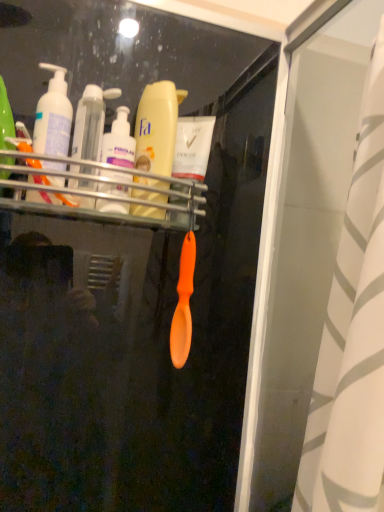
How much space does translucent plastic bottles at center, arranged as the second toiletry when viewed from the left, occupy horizontally?

It is 3.88 inches.

In order to face matte white pump bottle at left, should I rotate leftwards or rightwards?

Turn left approximately 18.345 degrees to face it.

Locate an element on the screen. translucent plastic bottles at center, arranged as the second toiletry when viewed from the left is located at coordinates (119, 142).

Does yellow matte lotion at center lie behind matte white pump bottle at left?

Yes, yellow matte lotion at center is further from the camera.

Is yellow matte lotion at center aimed at matte white pump bottle at left?

No, yellow matte lotion at center is not oriented towards matte white pump bottle at left.

Between yellow matte lotion at center and matte white pump bottle at left, which one has larger size?

matte white pump bottle at left is bigger.

From the image's perspective, which is below, matte white pump bottle at left or yellow matte lotion at center?

yellow matte lotion at center.

Is matte white pump bottle at left smaller than yellow matte lotion at center?

No.

Could you tell me if matte white pump bottle at left is facing yellow matte lotion at center?

No, matte white pump bottle at left is not turned towards yellow matte lotion at center.

Which of these two, matte white pump bottle at left or yellow matte lotion at center, is thinner?

yellow matte lotion at center is thinner.

Is translucent plastic bottles at center, marked as the first toiletry in a right-to-left arrangement, facing towards matte white pump bottle at left?

No, translucent plastic bottles at center, marked as the first toiletry in a right-to-left arrangement, is not facing towards matte white pump bottle at left.

From the image's perspective, does translucent plastic bottles at center, marked as the first toiletry in a right-to-left arrangement, appear lower than matte white pump bottle at left?

Yes.

Considering the relative positions of translucent plastic bottles at center, marked as the first toiletry in a right-to-left arrangement, and matte white pump bottle at left in the image provided, is translucent plastic bottles at center, marked as the first toiletry in a right-to-left arrangement, behind matte white pump bottle at left?

Yes, translucent plastic bottles at center, marked as the first toiletry in a right-to-left arrangement, is further from the viewer.

Considering the points (357, 311) and (71, 104), which point is behind, point (357, 311) or point (71, 104)?

The point (71, 104) is behind.

Based on the photo, is the position of white striped fabric at right less distant than that of matte white pump bottle at left?

Yes, white striped fabric at right is in front of matte white pump bottle at left.

How many degrees apart are the facing directions of yellow matte lotion at center and translucent plastic bottles at center left, the second toiletry when ordered from right to left?

The angle between the facing direction of yellow matte lotion at center and the facing direction of translucent plastic bottles at center left, the second toiletry when ordered from right to left, is 0.00444 degrees.

Considering the positions of objects yellow matte lotion at center and translucent plastic bottles at center left, which ranks as the 1th toiletry in left-to-right order, in the image provided, who is more to the right, yellow matte lotion at center or translucent plastic bottles at center left, which ranks as the 1th toiletry in left-to-right order,?

yellow matte lotion at center is more to the right.

Which object is further away from the camera, yellow matte lotion at center or translucent plastic bottles at center left, the second toiletry when ordered from right to left?

yellow matte lotion at center is further away from the camera.

The height and width of the screenshot is (512, 384). I want to click on bottle above the translucent plastic bottles at center left, the second toiletry when ordered from right to left (from the image's perspective), so click(157, 127).

Is translucent plastic bottles at center left, the second toiletry when ordered from right to left, surrounded by matte white pump bottle at left?

No.

From the picture: From the image's perspective, is matte white pump bottle at left positioned above or below translucent plastic bottles at center left, which ranks as the 1th toiletry in left-to-right order?

From the image's perspective, matte white pump bottle at left appears above translucent plastic bottles at center left, which ranks as the 1th toiletry in left-to-right order.

Looking at this image, looking at the image, does matte white pump bottle at left seem bigger or smaller compared to translucent plastic bottles at center left, the second toiletry when ordered from right to left?

Considering their sizes, matte white pump bottle at left takes up more space than translucent plastic bottles at center left, the second toiletry when ordered from right to left.

From the image's perspective, is white striped fabric at right beneath translucent plastic bottles at center left, which ranks as the 1th toiletry in left-to-right order?

Yes.

Does white striped fabric at right appear on the left side of translucent plastic bottles at center left, the second toiletry when ordered from right to left?

Incorrect, white striped fabric at right is not on the left side of translucent plastic bottles at center left, the second toiletry when ordered from right to left.

Measure the distance between white striped fabric at right and translucent plastic bottles at center left, the second toiletry when ordered from right to left.

white striped fabric at right and translucent plastic bottles at center left, the second toiletry when ordered from right to left, are 15.28 inches apart.

From a real-world perspective, is white striped fabric at right on top of translucent plastic bottles at center left, which ranks as the 1th toiletry in left-to-right order?

Incorrect, from a real-world perspective, white striped fabric at right is lower than translucent plastic bottles at center left, which ranks as the 1th toiletry in left-to-right order.

Find the location of a particular element. The height and width of the screenshot is (512, 384). cleaning product that is on the left side of yellow matte lotion at center is located at coordinates (53, 116).

At what (x,y) coordinates should I click in order to perform the action: click on bottle that appears on the right of matte white pump bottle at left. Please return your answer as a coordinate pair (x, y). Looking at the image, I should click on (157, 127).

Which object lies nearer to the anchor point white striped fabric at right, yellow matte lotion at center or translucent plastic bottles at center, arranged as the second toiletry when viewed from the left?

Among the two, yellow matte lotion at center is located nearer to white striped fabric at right.

Estimate the real-world distances between objects in this image. Which object is further from yellow matte lotion at center, white striped fabric at right or translucent plastic bottles at center left, which ranks as the 1th toiletry in left-to-right order?

white striped fabric at right is positioned further to the anchor yellow matte lotion at center.

From the image, which object appears to be nearer to yellow matte lotion at center, matte white pump bottle at left or white striped fabric at right?

The object closer to yellow matte lotion at center is matte white pump bottle at left.

Considering their positions, is yellow matte lotion at center positioned further to white striped fabric at right than matte white pump bottle at left?

Based on the image, matte white pump bottle at left appears to be further to white striped fabric at right.

Which object lies nearer to the anchor point translucent plastic bottles at center left, which ranks as the 1th toiletry in left-to-right order, translucent plastic bottles at center, arranged as the second toiletry when viewed from the left, or white striped fabric at right?

translucent plastic bottles at center, arranged as the second toiletry when viewed from the left.

From the image, which object appears to be nearer to matte white pump bottle at left, yellow matte lotion at center or white striped fabric at right?

yellow matte lotion at center lies closer to matte white pump bottle at left than the other object.

From the image, which object appears to be farther from yellow matte lotion at center, translucent plastic bottles at center left, the second toiletry when ordered from right to left, or translucent plastic bottles at center, marked as the first toiletry in a right-to-left arrangement?

Based on the image, translucent plastic bottles at center left, the second toiletry when ordered from right to left, appears to be further to yellow matte lotion at center.

Estimate the real-world distances between objects in this image. Which object is further from translucent plastic bottles at center, marked as the first toiletry in a right-to-left arrangement, matte white pump bottle at left or yellow matte lotion at center?

matte white pump bottle at left.

Locate an element on the screen. This screenshot has height=512, width=384. cleaning product positioned between white striped fabric at right and translucent plastic bottles at center left, the second toiletry when ordered from right to left, from near to far is located at coordinates (53, 116).

This screenshot has width=384, height=512. Identify the location of cleaning product between white striped fabric at right and yellow matte lotion at center along the z-axis. (53, 116).

The image size is (384, 512). Identify the location of toiletry between translucent plastic bottles at center left, the second toiletry when ordered from right to left, and yellow matte lotion at center from left to right. (119, 142).

Identify the location of cleaning product between white striped fabric at right and translucent plastic bottles at center, arranged as the second toiletry when viewed from the left, from front to back. The image size is (384, 512). (53, 116).